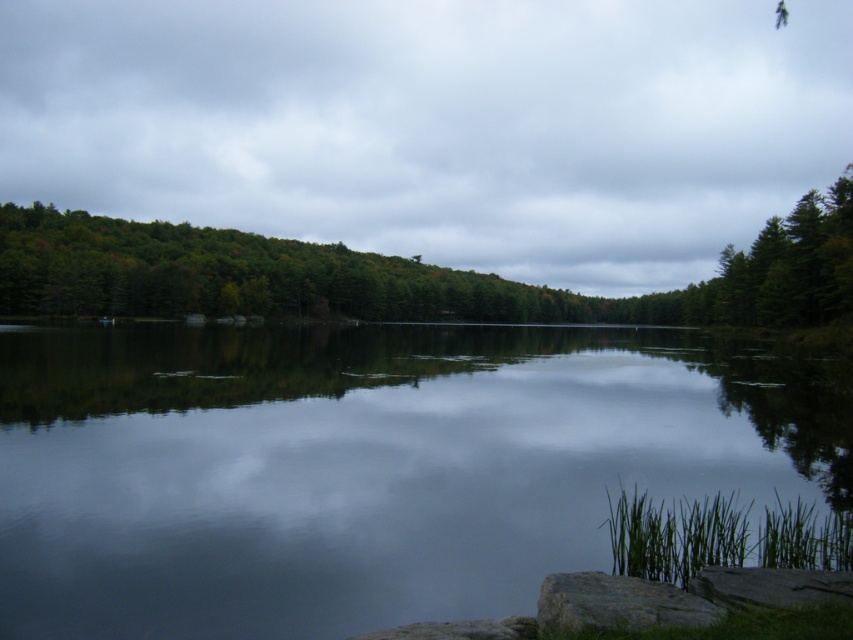
Question: Is transparent water at center above green matte tree at upper center?

Choices:
 (A) yes
 (B) no

Answer: (B)

Question: Observing the image, what is the correct spatial positioning of transparent water at center in reference to green matte tree at upper center?

Choices:
 (A) right
 (B) left

Answer: (B)

Question: Among these objects, which one is nearest to the camera?

Choices:
 (A) green matte tree at upper center
 (B) transparent water at center

Answer: (B)

Question: Which object appears closest to the camera in this image?

Choices:
 (A) green matte tree at upper center
 (B) transparent water at center

Answer: (B)

Question: Is transparent water at center thinner than green matte tree at upper center?

Choices:
 (A) yes
 (B) no

Answer: (A)